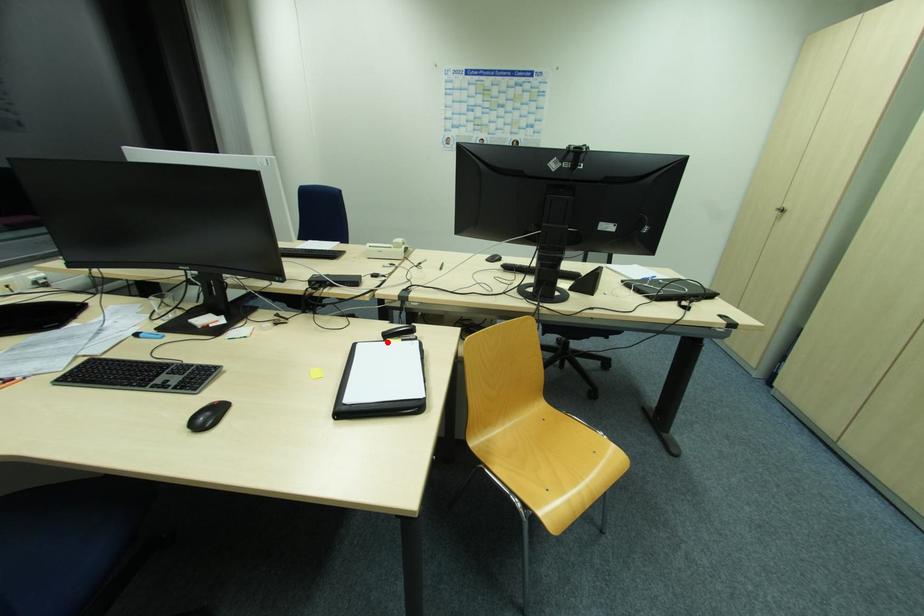
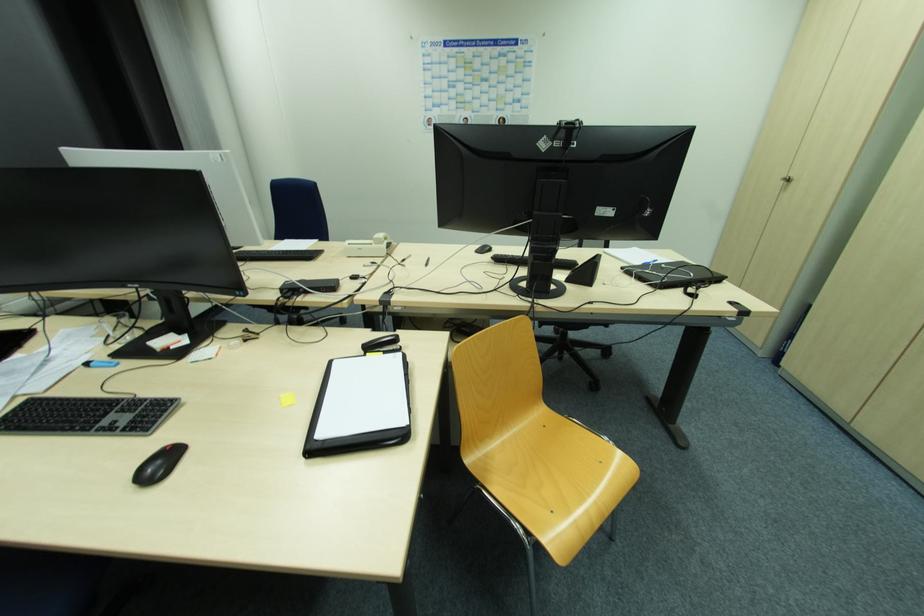
The point at the highlighted location is marked in the first image. Where is the corresponding point in the second image?

(368, 357)